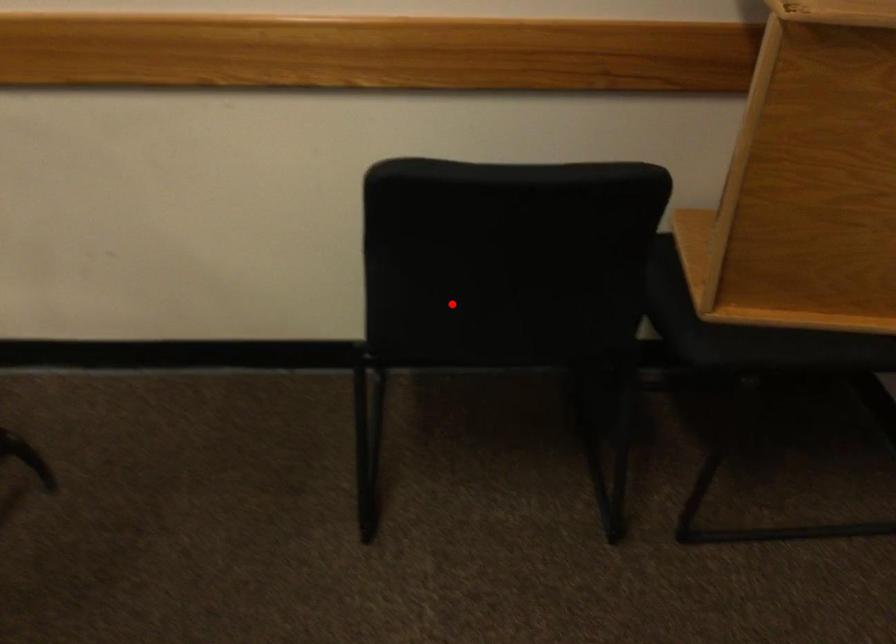
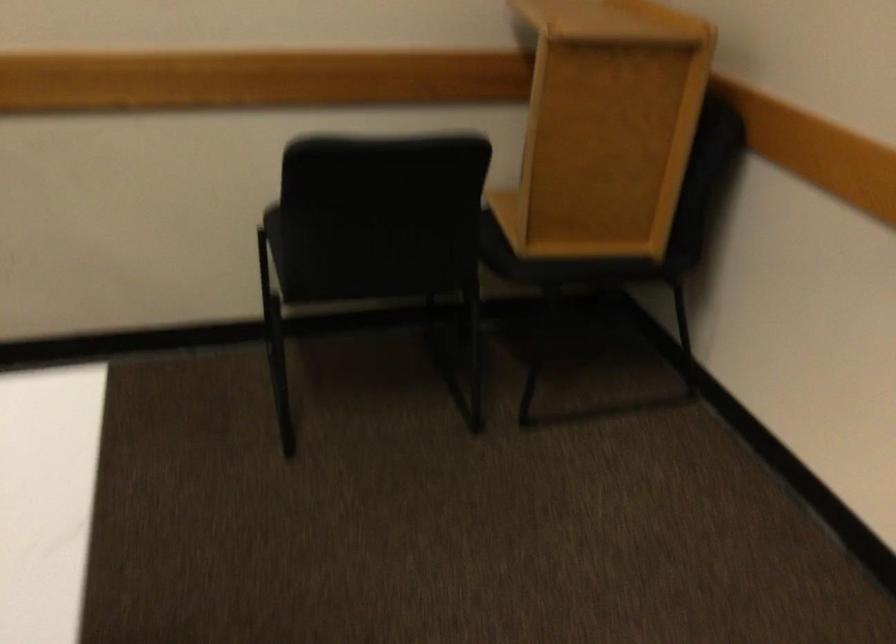
Question: I am providing you with two images of the same scene from different viewpoints. A red point is shown in image1. For the corresponding object point in image2, is it positioned nearer or farther from the camera?

Choices:
 (A) Nearer
 (B) Farther

Answer: (B)